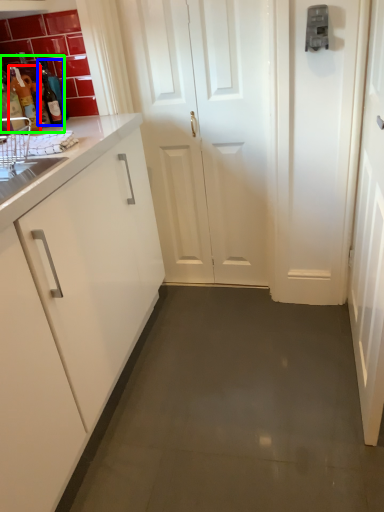
Question: Estimate the real-world distances between objects in this image. Which object is closer to bottle (highlighted by a red box), bottle (highlighted by a blue box) or bottle (highlighted by a green box)?

Choices:
 (A) bottle
 (B) bottle

Answer: (B)